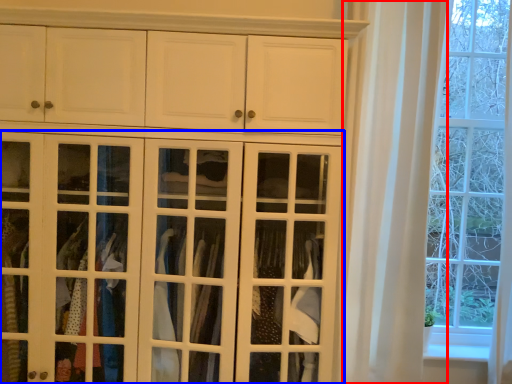
Question: Which object is further to the camera taking this photo, curtain (highlighted by a red box) or door (highlighted by a blue box)?

Choices:
 (A) curtain
 (B) door

Answer: (A)